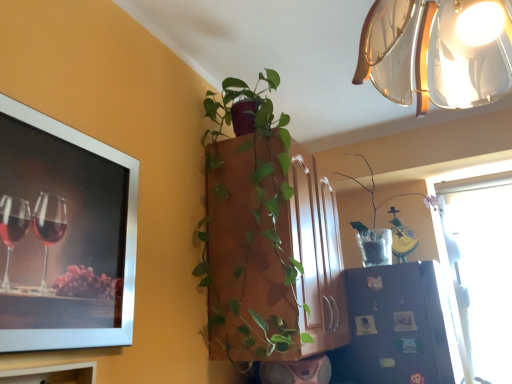
Question: Can you confirm if black matte refrigerator at lower right is positioned to the left of translucent glass lampshade at upper right?

Choices:
 (A) no
 (B) yes

Answer: (A)

Question: Is black matte refrigerator at lower right positioned with its back to translucent glass lampshade at upper right?

Choices:
 (A) yes
 (B) no

Answer: (B)

Question: From the image's perspective, does black matte refrigerator at lower right appear lower than translucent glass lampshade at upper right?

Choices:
 (A) yes
 (B) no

Answer: (A)

Question: Is black matte refrigerator at lower right bigger than translucent glass lampshade at upper right?

Choices:
 (A) yes
 (B) no

Answer: (B)

Question: Is black matte refrigerator at lower right shorter than translucent glass lampshade at upper right?

Choices:
 (A) no
 (B) yes

Answer: (A)

Question: From a real-world perspective, is black matte refrigerator at lower right physically below translucent glass lampshade at upper right?

Choices:
 (A) yes
 (B) no

Answer: (A)

Question: Does green matte plant at center, acting as the second houseplant starting from the right, come behind black matte refrigerator at lower right?

Choices:
 (A) no
 (B) yes

Answer: (A)

Question: From the image's perspective, is green matte plant at center, placed as the 2th houseplant when sorted from back to front, on top of black matte refrigerator at lower right?

Choices:
 (A) yes
 (B) no

Answer: (A)

Question: Is green matte plant at center, the 1th houseplant when ordered from left to right, positioned before black matte refrigerator at lower right?

Choices:
 (A) no
 (B) yes

Answer: (B)

Question: Does green matte plant at center, the 1th houseplant when ordered from left to right, have a greater height compared to black matte refrigerator at lower right?

Choices:
 (A) no
 (B) yes

Answer: (B)

Question: Can you confirm if green matte plant at center, the 1th houseplant when ordered from left to right, is wider than black matte refrigerator at lower right?

Choices:
 (A) yes
 (B) no

Answer: (A)

Question: From a real-world perspective, is green matte plant at center, the 1th houseplant when ordered from left to right, on black matte refrigerator at lower right?

Choices:
 (A) no
 (B) yes

Answer: (B)

Question: Would you say silver metallic picture frame at upper left is part of green matte plant at center, the 1th houseplant when ordered from left to right,'s contents?

Choices:
 (A) no
 (B) yes

Answer: (A)